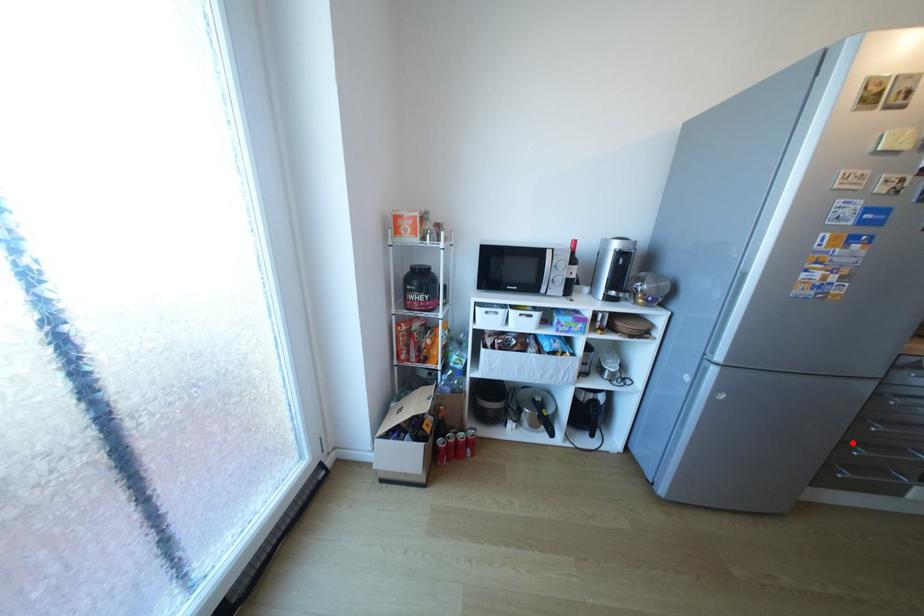
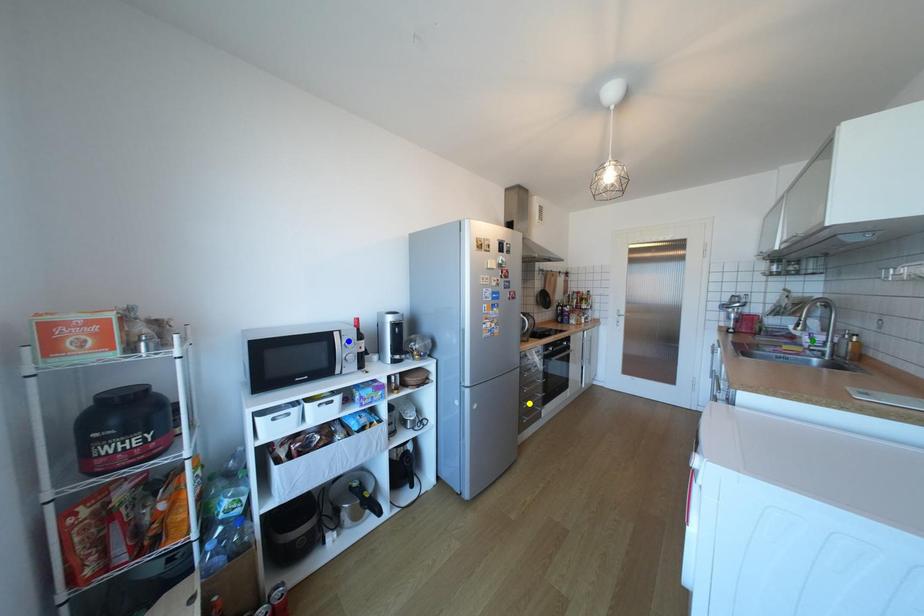
Question: I am providing you with two images of the same scene from different viewpoints. A red point is marked on the first image. You are given multiple points on the second image. Can you choose the point in image 2 that corresponds to the point in image 1?

Choices:
 (A) green point
 (B) blue point
 (C) yellow point

Answer: (C)